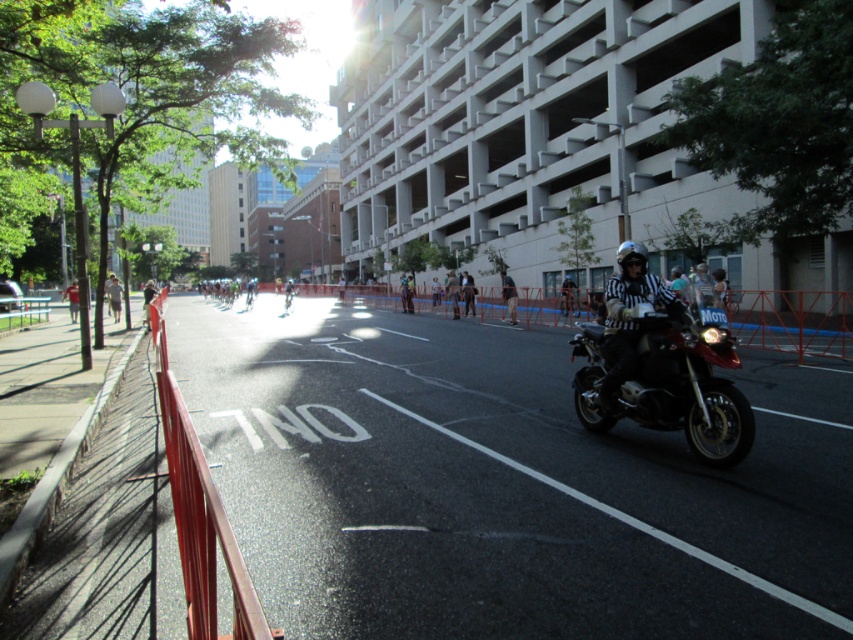
Between white shirt at center and black leather jacket at center, which one appears on the left side from the viewer's perspective?

From the viewer's perspective, white shirt at center appears more on the left side.

Identify the location of white shirt at center. coord(453,292).

Is point (445, 291) positioned before point (469, 280)?

No, it is not.

Where is `white shirt at center`? white shirt at center is located at coordinates (453, 292).

Between point (112, 310) and point (68, 292), which one is positioned in front?

Point (112, 310) is more forward.

Can you confirm if light brown fabric shirt at center is taller than red shirt at center?

Incorrect, light brown fabric shirt at center's height is not larger of red shirt at center's.

Does point (108, 300) lie in front of point (65, 298)?

Yes.

Identify the location of light brown fabric shirt at center. (114, 296).

Who is taller, striped referee shirt at center or light brown fabric shirt at center?

Standing taller between the two is striped referee shirt at center.

Which is behind, point (566, 298) or point (109, 298)?

The point (566, 298) is more distant.

Image resolution: width=853 pixels, height=640 pixels. What are the coordinates of `striped referee shirt at center` in the screenshot? It's located at (569, 298).